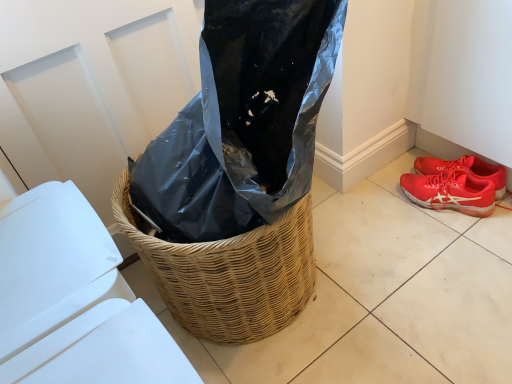
Identify the location of free space in front of red mesh shoe at lower right, the 2th footwear positioned from the bottom. This screenshot has height=384, width=512. (465, 240).